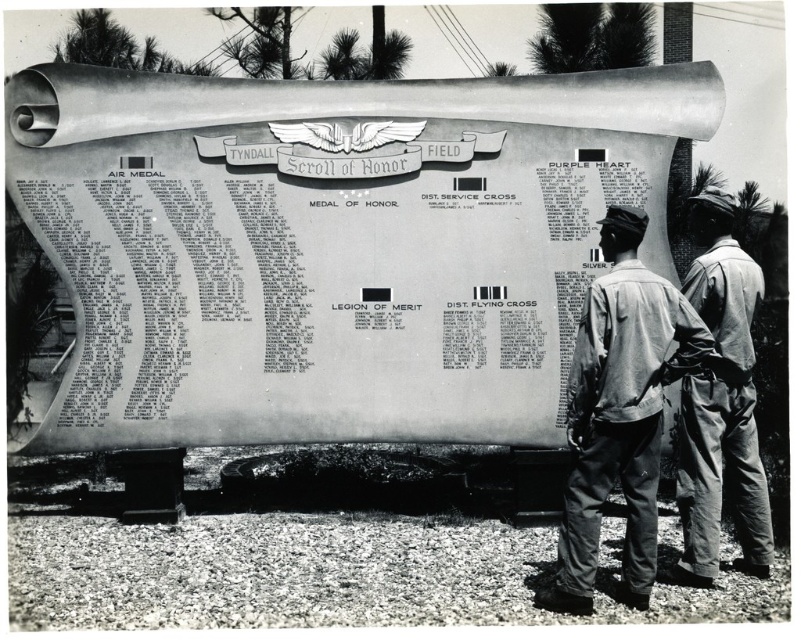
Question: Can you confirm if gray fabric jacket at center is positioned above denim pants at lower right?

Choices:
 (A) no
 (B) yes

Answer: (A)

Question: Which point is closer to the camera?

Choices:
 (A) denim pants at lower right
 (B) gray fabric jacket at center

Answer: (B)

Question: Is gray fabric jacket at center thinner than denim pants at lower right?

Choices:
 (A) yes
 (B) no

Answer: (B)

Question: Can you confirm if gray fabric jacket at center is smaller than denim pants at lower right?

Choices:
 (A) no
 (B) yes

Answer: (A)

Question: Which point appears farthest from the camera in this image?

Choices:
 (A) (634, 419)
 (B) (731, 403)

Answer: (B)